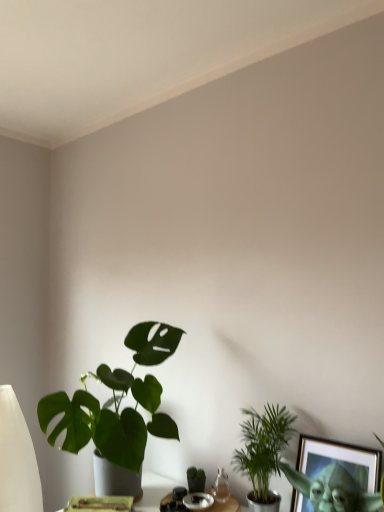
Question: Which direction should I rotate to look at green matte houseplant at center, which ranks as the second houseplant in left-to-right order?

Choices:
 (A) right
 (B) left

Answer: (A)

Question: Does green matte houseplant at center, the 2th houseplant from the right, have a lesser height compared to green leafy plant at lower right, which appears as the 1th houseplant when viewed from the right?

Choices:
 (A) no
 (B) yes

Answer: (B)

Question: Is green matte houseplant at center, which ranks as the second houseplant in left-to-right order, bigger than green leafy plant at lower right, which appears as the 1th houseplant when viewed from the right?

Choices:
 (A) no
 (B) yes

Answer: (A)

Question: Considering the relative positions of green matte houseplant at center, which ranks as the second houseplant in left-to-right order, and green leafy plant at lower right, which appears as the 1th houseplant when viewed from the right, in the image provided, is green matte houseplant at center, which ranks as the second houseplant in left-to-right order, to the left of green leafy plant at lower right, which appears as the 1th houseplant when viewed from the right, from the viewer's perspective?

Choices:
 (A) yes
 (B) no

Answer: (A)

Question: Does green matte houseplant at center, the 2th houseplant from the right, turn towards green leafy plant at lower right, which appears as the 1th houseplant when viewed from the right?

Choices:
 (A) yes
 (B) no

Answer: (B)

Question: Is green matte houseplant at center, which ranks as the second houseplant in left-to-right order, touching green leafy plant at lower right, which appears as the 1th houseplant when viewed from the right?

Choices:
 (A) yes
 (B) no

Answer: (B)

Question: Is green matte houseplant at center, the 2th houseplant from the right, surrounding green leafy plant at lower right, which appears as the 1th houseplant when viewed from the right?

Choices:
 (A) no
 (B) yes

Answer: (A)

Question: Would you say green leafy plant at lower right, the 3th houseplant when ordered from left to right, contains gold-framed picture at lower right?

Choices:
 (A) yes
 (B) no

Answer: (B)

Question: Does green leafy plant at lower right, which appears as the 1th houseplant when viewed from the right, have a smaller size compared to gold-framed picture at lower right?

Choices:
 (A) yes
 (B) no

Answer: (B)

Question: From a real-world perspective, is green leafy plant at lower right, the 3th houseplant when ordered from left to right, on gold-framed picture at lower right?

Choices:
 (A) yes
 (B) no

Answer: (A)

Question: Can you confirm if green leafy plant at lower right, which appears as the 1th houseplant when viewed from the right, is thinner than gold-framed picture at lower right?

Choices:
 (A) no
 (B) yes

Answer: (A)

Question: Is green leafy plant at lower right, the 3th houseplant when ordered from left to right, bigger than gold-framed picture at lower right?

Choices:
 (A) no
 (B) yes

Answer: (B)

Question: Can you confirm if green leafy plant at lower right, which appears as the 1th houseplant when viewed from the right, is positioned to the left of gold-framed picture at lower right?

Choices:
 (A) yes
 (B) no

Answer: (A)

Question: Is green matte plant at lower left, the 3th houseplant when ordered from right to left, facing away from green matte houseplant at center, which ranks as the second houseplant in left-to-right order?

Choices:
 (A) yes
 (B) no

Answer: (A)